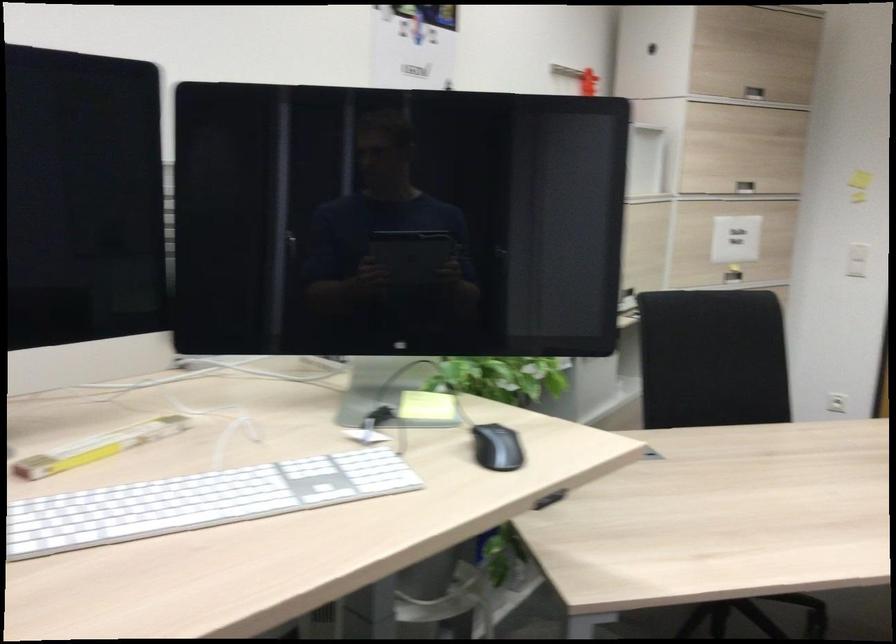
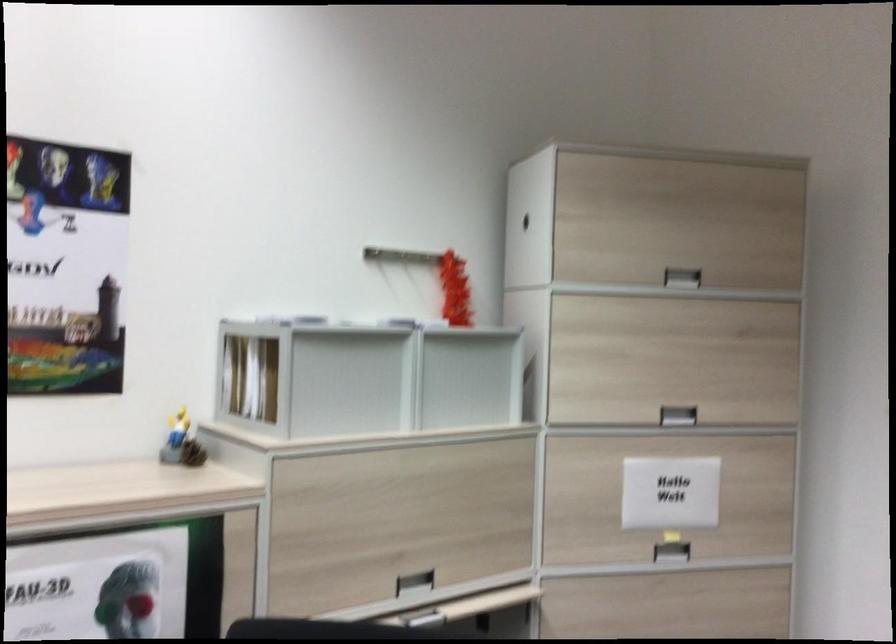
Locate, in the second image, the point that corresponds to (754,185) in the first image.

(677, 415)